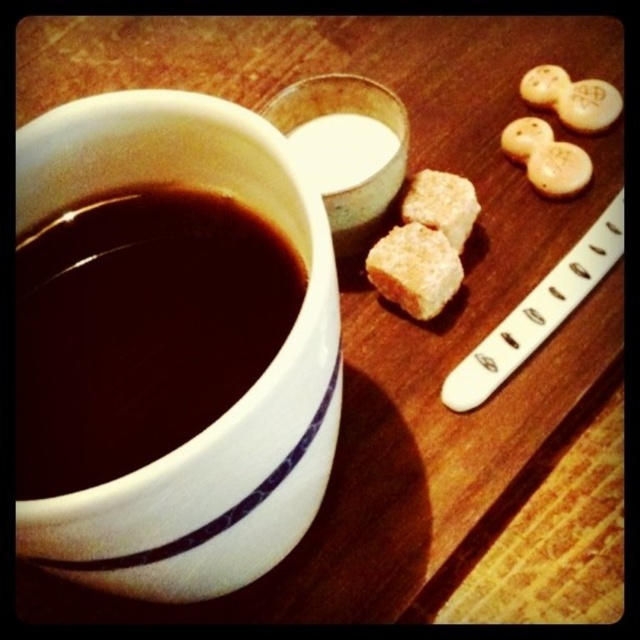
Between white textured cookie at upper right and white matte cookie at upper right, which one has less height?

white textured cookie at upper right is shorter.

Can you confirm if white textured cookie at upper right is bigger than white matte cookie at upper right?

No, white textured cookie at upper right is not bigger than white matte cookie at upper right.

I want to click on white textured cookie at upper right, so click(557, 168).

Which is more to the left, brown sugar cube at center or white matte milk at center?

white matte milk at center is more to the left.

Does point (436, 236) come in front of point (376, 170)?

That is True.

What do you see at coordinates (413, 269) in the screenshot? I see `brown sugar cube at center` at bounding box center [413, 269].

Where is `brown sugar cube at center`? The image size is (640, 640). brown sugar cube at center is located at coordinates (413, 269).

I want to click on brown sugar cube at center, so point(413,269).